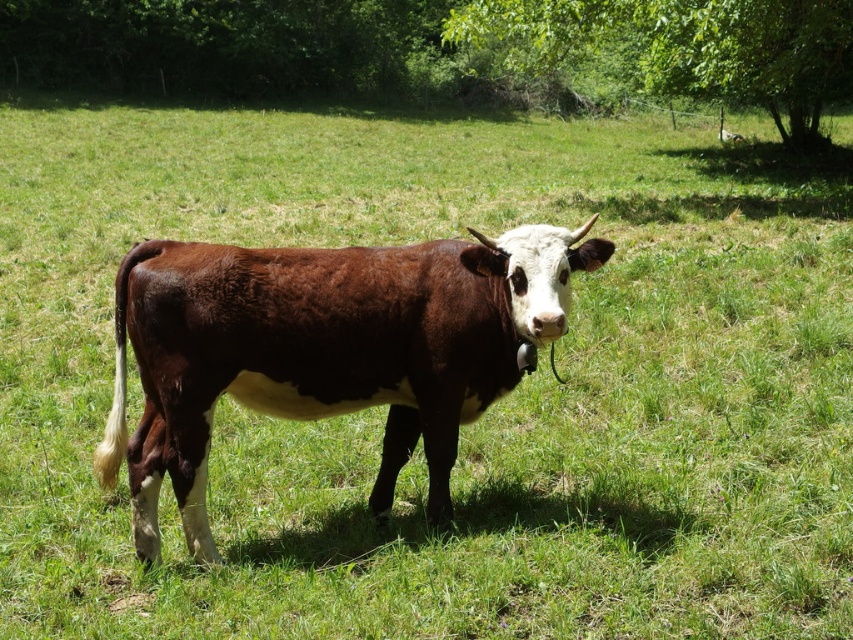
You are a farmer who wants to place a fence between the brown smooth cow at center and the green leafy tree at upper right to keep the cow from reaching the tree. What is the minimum length of fencing you need to install?

The minimum length of fencing required is 12.93 meters, as the distance between the brown smooth cow at center and the green leafy tree at upper right is exactly 12.93 meters.

Looking at this image, you are standing in the field and see the cow represented by the point at coordinates (326, 349). Which direction should you walk to get closer to the cow?

The cow represented by the point at coordinates (326, 349) is located at the center of the field, so you should walk towards the center of the field to get closer to the cow.

You are a farmer checking the field. You notice the brown smooth cow at center and the green leafy tree at upper right. Which object is casting a shadow over the other?

The green leafy tree at upper right is casting a shadow over the brown smooth cow at center because the cow is positioned under the tree.